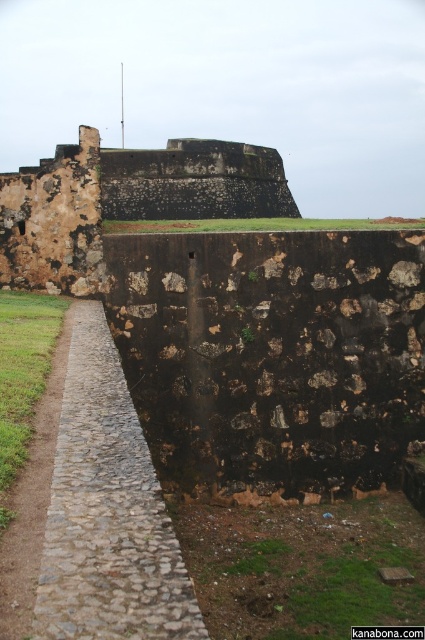
Is point (76, 401) farther from viewer compared to point (189, 168)?

No.

Find the location of a particular element. gray cobblestone path at center is located at coordinates (107, 513).